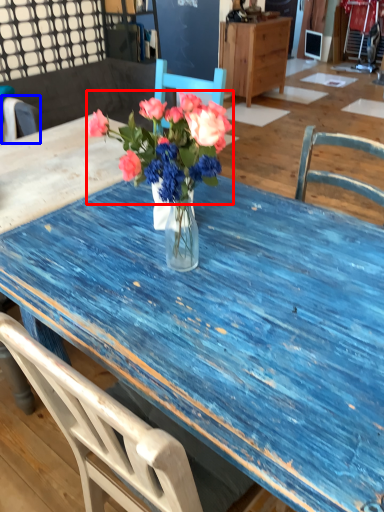
Question: Which object is closer to the camera taking this photo, flower (highlighted by a red box) or chair (highlighted by a blue box)?

Choices:
 (A) flower
 (B) chair

Answer: (A)